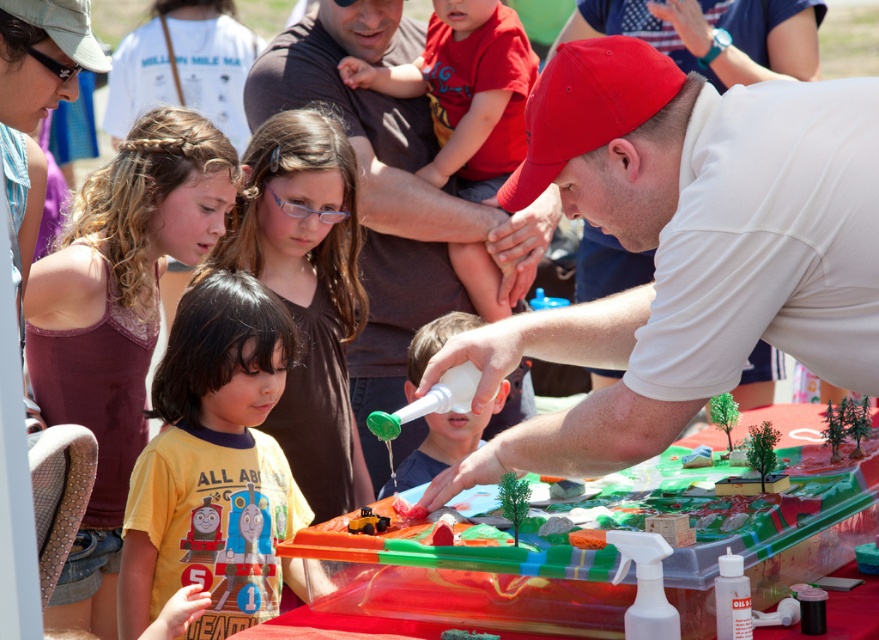
Question: Which object appears closest to the camera in this image?

Choices:
 (A) red cotton shirt at upper center
 (B) translucent plastic table at center
 (C) yellow matte shirt at lower left
 (D) matte yellow shirt at center

Answer: (B)

Question: Is white matte bottle at center to the left of smooth plastic bottle at center from the viewer's perspective?

Choices:
 (A) no
 (B) yes

Answer: (B)

Question: Which of the following is the closest to the observer?

Choices:
 (A) white matte bottle at center
 (B) translucent plastic table at center
 (C) white matte shirt at center
 (D) matte yellow shirt at center

Answer: (B)

Question: Which point is farther from the camera taking this photo?

Choices:
 (A) (93, 388)
 (B) (362, 60)
 (C) (745, 561)

Answer: (B)

Question: Is yellow matte shirt at lower left below white matte bottle at center?

Choices:
 (A) yes
 (B) no

Answer: (A)

Question: Is yellow matte shirt at lower left to the right of red cotton shirt at upper center from the viewer's perspective?

Choices:
 (A) no
 (B) yes

Answer: (A)